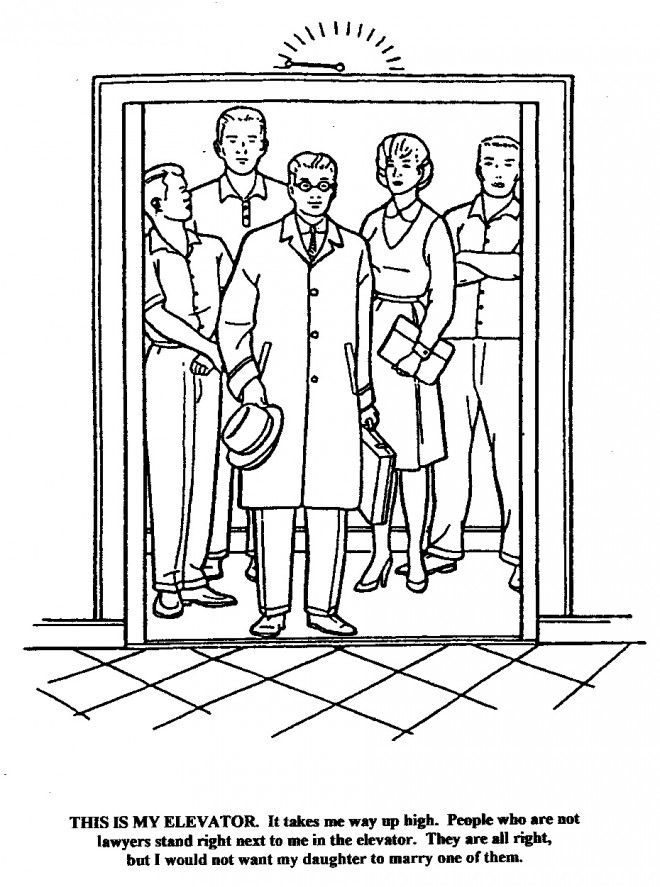
Identify the location of elevator frame. (472, 90).